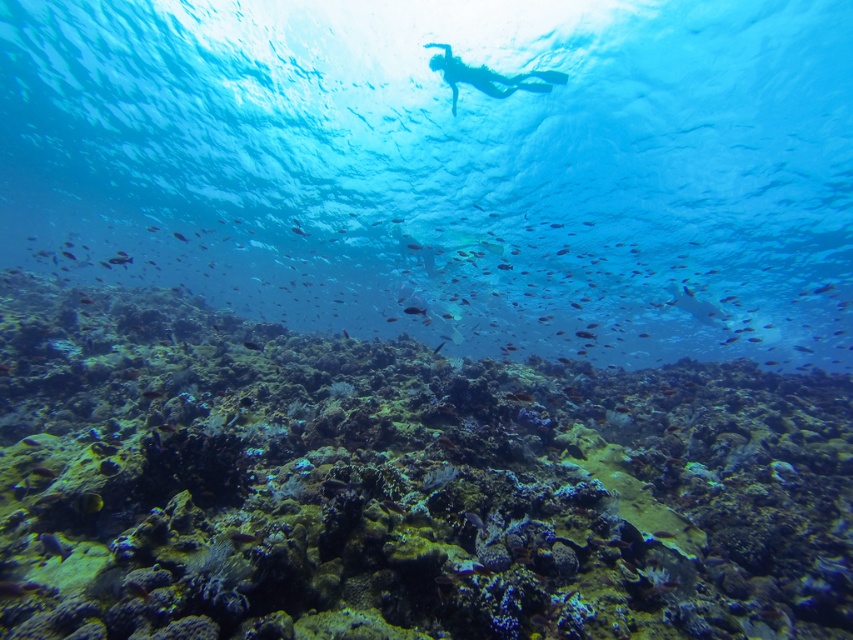
Looking at this image, you are a marine biologist observing this underwater scene. You notice the translucent blue water at center and the transparent blue diver at upper center. Based on their positions, which object is closer to the surface of the ocean?

The transparent blue diver at upper center is closer to the surface of the ocean because it is positioned above the translucent blue water at center, which is much taller than the diver.

You are a marine biologist observing the underwater scene. You notice the rough textured coral reef at center and the transparent blue diver at upper center. Which object is positioned closer to your viewpoint?

The rough textured coral reef at center is closer to the viewer than the transparent blue diver at upper center.

What is the 2D coordinate of the translucent blue water at center?

The 2D coordinate of the translucent blue water at center is at point (447, 168).